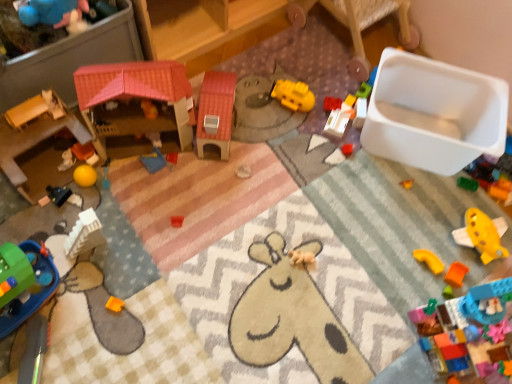
Where is `free space between blue plastic tray at center, which ranks as the 10th toy in right-to-left order, and translucent blue plastic blocks at lower right, the thirteenth toy viewed from the left`? free space between blue plastic tray at center, which ranks as the 10th toy in right-to-left order, and translucent blue plastic blocks at lower right, the thirteenth toy viewed from the left is located at coordinates (305, 256).